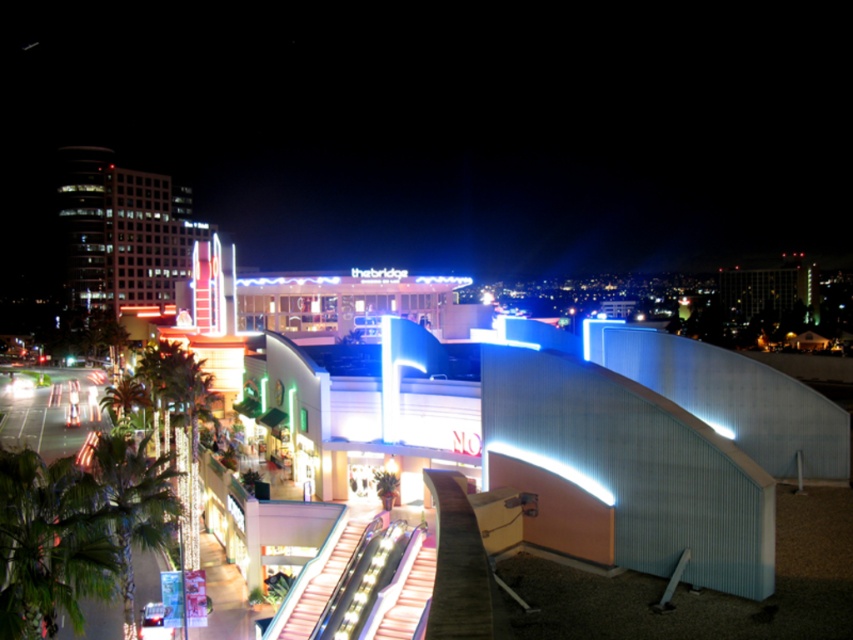
You are a city planner evaluating the visibility of the glassy white building at upper left and the metallic silver escalator at center from a distance. Based on their sizes, which one is more likely to be easily noticed first?

The glassy white building at upper left is more likely to be easily noticed first because it has a larger size compared to the metallic silver escalator at center.

You are standing at the entrance of the shopping district and want to take a photo of the glassy white building at upper left. Considering the distance, will you need a zoom lens to capture the entire building in your shot?

The glassy white building at upper left is 711.70 feet away from the camera. Given this significant distance, using a zoom lens would be necessary to ensure the entire building fits within the frame.

You are an architect analyzing the urban layout. Based on the scene, which object occupies a larger horizontal space in the image? The glassy white building at upper left or the metallic silver escalator at center?

The glassy white building at upper left is wider than the metallic silver escalator at center, so it occupies a larger horizontal space in the image.